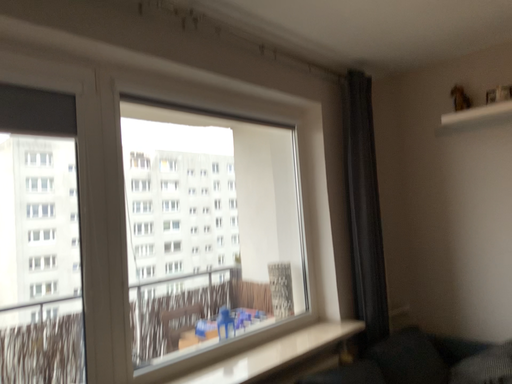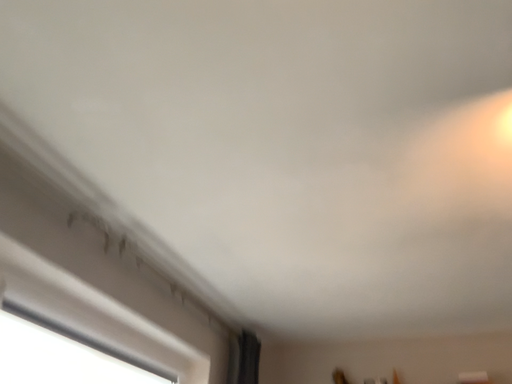
Question: How did the camera likely rotate when shooting the video?

Choices:
 (A) rotated left
 (B) rotated right

Answer: (B)